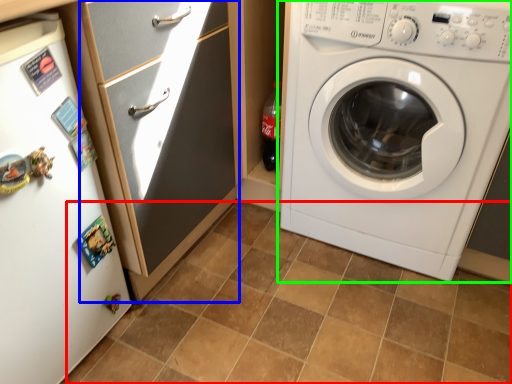
Question: Which object is positioned farthest from ceramic tile (highlighted by a red box)? Select from screen door (highlighted by a blue box) and washing machine (highlighted by a green box).

Choices:
 (A) screen door
 (B) washing machine

Answer: (A)